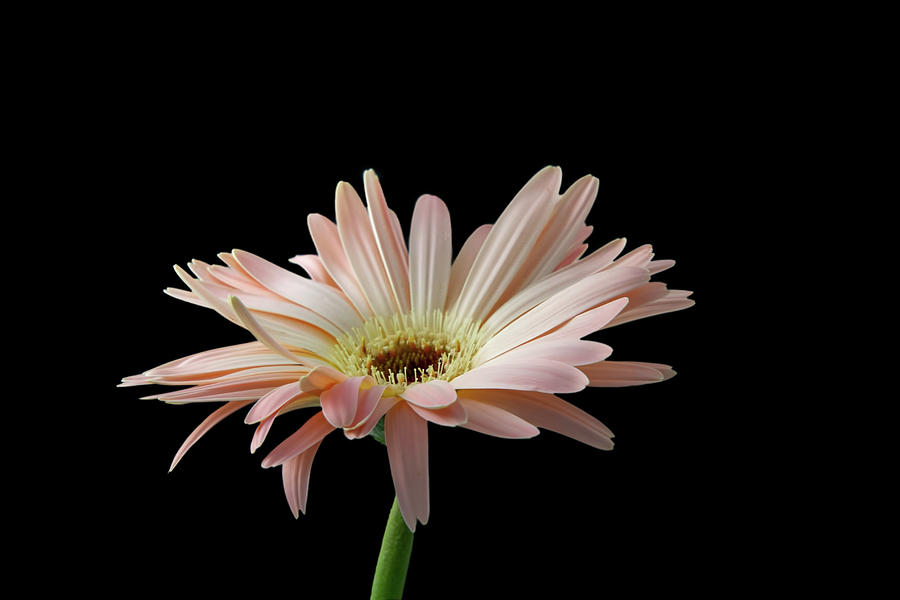
The image size is (900, 600). I want to click on the bottom of visible flower stem, so click(388, 588).